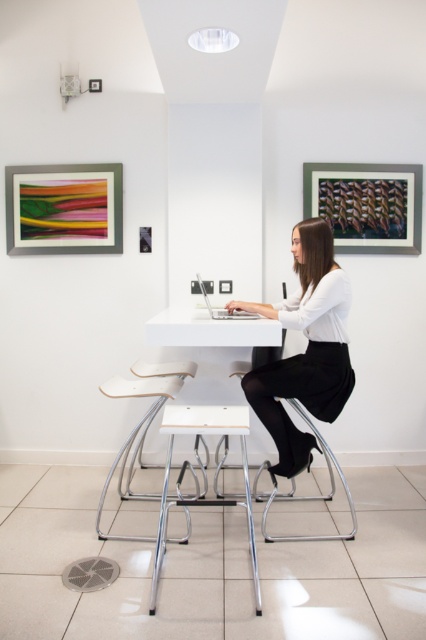
Question: Which object appears farthest from the camera in this image?

Choices:
 (A) metallic silver picture frame at upper left
 (B) silver metallic laptop at center
 (C) white matte table at center

Answer: (A)

Question: Estimate the real-world distances between objects in this image. Which object is farther from the silver metallic laptop at center?

Choices:
 (A) white leather stool at center
 (B) white matte skirt at center
 (C) wooden textured frame at upper right
 (D) white plastic stool at center

Answer: (C)

Question: Is white matte skirt at center to the right of white matte table at center from the viewer's perspective?

Choices:
 (A) yes
 (B) no

Answer: (A)

Question: Which point appears closest to the camera in this image?

Choices:
 (A) (212, 410)
 (B) (52, 212)
 (C) (204, 296)
 (D) (144, 376)

Answer: (A)

Question: Does white matte skirt at center appear on the right side of white matte table at center?

Choices:
 (A) no
 (B) yes

Answer: (B)

Question: In this image, where is metallic silver picture frame at upper left located relative to white leather stool at center?

Choices:
 (A) right
 (B) left

Answer: (B)